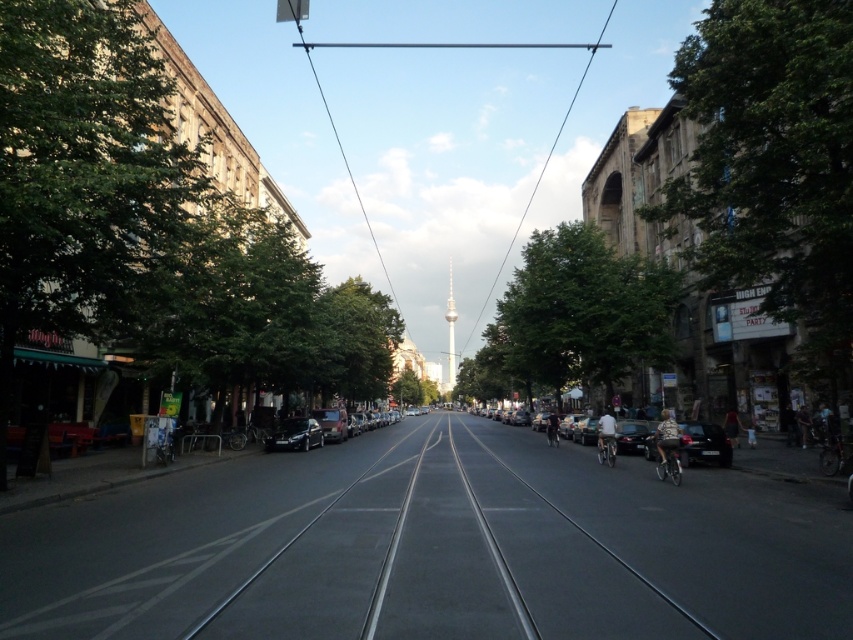
Does point (566, 529) come closer to viewer compared to point (695, 449)?

Yes, point (566, 529) is closer to viewer.

Is black asphalt train track at center bigger than matte black car at center-right?

Actually, black asphalt train track at center might be smaller than matte black car at center-right.

Does point (328, 557) come behind point (633, 436)?

No.

Image resolution: width=853 pixels, height=640 pixels. In order to click on black asphalt train track at center in this screenshot , I will do `click(445, 561)`.

Looking at this image, who is shorter, metallic wire at center or matte black car at center-right?

matte black car at center-right is shorter.

How much distance is there between metallic wire at center and matte black car at center-right?

They are 308.70 feet apart.

Describe the element at coordinates (433, 48) in the screenshot. I see `metallic wire at center` at that location.

Image resolution: width=853 pixels, height=640 pixels. In order to click on metallic wire at center in this screenshot , I will do `click(433, 48)`.

Can you confirm if black asphalt train track at center is positioned to the right of metallic wire at center?

Indeed, black asphalt train track at center is positioned on the right side of metallic wire at center.

Who is positioned more to the right, black asphalt train track at center or metallic wire at center?

black asphalt train track at center is more to the right.

Between point (640, 612) and point (343, 157), which one is positioned behind?

The point (343, 157) is more distant.

I want to click on black asphalt train track at center, so click(445, 561).